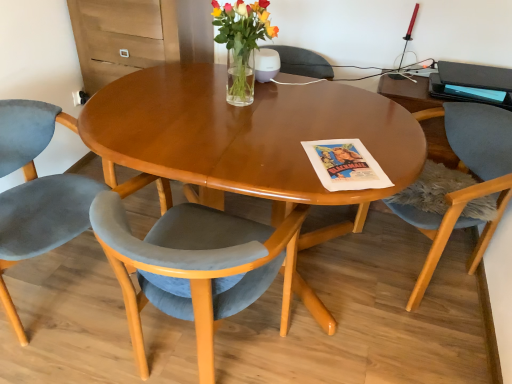
Find the location of a particular element. The height and width of the screenshot is (384, 512). velvet blue chair at lower right, which is the first chair in right-to-left order is located at coordinates (468, 187).

This screenshot has width=512, height=384. Describe the element at coordinates (468, 92) in the screenshot. I see `matte black magazine at upper right` at that location.

Describe the element at coordinates (36, 192) in the screenshot. Image resolution: width=512 pixels, height=384 pixels. I see `velvet grey chair at lower left, the third chair viewed from the right` at that location.

You are a GUI agent. You are given a task and a screenshot of the screen. Output one action in this format:
    pyautogui.click(x=<x>, y=<y>)
    Task: Click on the velvet blue chair at lower right, which is the first chair in right-to-left order
    Image resolution: width=512 pixels, height=384 pixels.
    Given the screenshot: What is the action you would take?
    pyautogui.click(x=468, y=187)

Is matte black magazine at upper right wider or thinner than velvet grey chair at lower left, placed as the second chair when sorted from right to left?

In the image, matte black magazine at upper right appears to be more narrow than velvet grey chair at lower left, placed as the second chair when sorted from right to left.

Can you confirm if matte black magazine at upper right is shorter than velvet grey chair at lower left, acting as the 2th chair starting from the left?

Yes.

Considering the sizes of objects matte black magazine at upper right and velvet grey chair at lower left, placed as the second chair when sorted from right to left, in the image provided, who is smaller, matte black magazine at upper right or velvet grey chair at lower left, placed as the second chair when sorted from right to left,?

matte black magazine at upper right.

Between point (480, 91) and point (197, 260), which one is positioned in front?

The point (197, 260) is closer to the camera.

Is velvet grey chair at lower left, placed as the second chair when sorted from right to left, to the left of velvet grey chair at lower left, which is the 1th chair in left-to-right order, from the viewer's perspective?

No.

Considering the positions of objects velvet grey chair at lower left, acting as the 2th chair starting from the left, and velvet grey chair at lower left, which is the 1th chair in left-to-right order, in the image provided, who is in front, velvet grey chair at lower left, acting as the 2th chair starting from the left, or velvet grey chair at lower left, which is the 1th chair in left-to-right order,?

velvet grey chair at lower left, acting as the 2th chair starting from the left, is more forward.

Consider the image. What's the angular difference between velvet grey chair at lower left, acting as the 2th chair starting from the left, and velvet grey chair at lower left, the third chair viewed from the right,'s facing directions?

99 degrees separate the facing orientations of velvet grey chair at lower left, acting as the 2th chair starting from the left, and velvet grey chair at lower left, the third chair viewed from the right.

Consider the image. Does velvet grey chair at lower left, placed as the second chair when sorted from right to left, have a lesser width compared to velvet grey chair at lower left, the third chair viewed from the right?

Indeed, velvet grey chair at lower left, placed as the second chair when sorted from right to left, has a lesser width compared to velvet grey chair at lower left, the third chair viewed from the right.

In the scene shown: Is velvet grey chair at lower left, which is the 1th chair in left-to-right order, further to the viewer compared to translucent glass vase at center?

No, velvet grey chair at lower left, which is the 1th chair in left-to-right order, is closer to the camera.

Is velvet grey chair at lower left, which is the 1th chair in left-to-right order, oriented towards translucent glass vase at center?

No, velvet grey chair at lower left, which is the 1th chair in left-to-right order, is not oriented towards translucent glass vase at center.

Considering the positions of objects velvet grey chair at lower left, which is the 1th chair in left-to-right order, and translucent glass vase at center in the image provided, who is more to the left, velvet grey chair at lower left, which is the 1th chair in left-to-right order, or translucent glass vase at center?

velvet grey chair at lower left, which is the 1th chair in left-to-right order.

Based on the photo, is velvet grey chair at lower left, which is the 1th chair in left-to-right order, not inside translucent glass vase at center?

Yes, velvet grey chair at lower left, which is the 1th chair in left-to-right order, is outside of translucent glass vase at center.

In the scene shown: From a real-world perspective, is translucent glass vase at center under velvet grey chair at lower left, acting as the 2th chair starting from the left?

No, from a real-world perspective, translucent glass vase at center is not beneath velvet grey chair at lower left, acting as the 2th chair starting from the left.

From the image's perspective, who appears lower, translucent glass vase at center or velvet grey chair at lower left, placed as the second chair when sorted from right to left?

velvet grey chair at lower left, placed as the second chair when sorted from right to left, appears lower in the image.

Between translucent glass vase at center and velvet grey chair at lower left, acting as the 2th chair starting from the left, which one appears on the right side from the viewer's perspective?

translucent glass vase at center is more to the right.

Would you say translucent glass vase at center is inside or outside velvet grey chair at lower left, acting as the 2th chair starting from the left?

translucent glass vase at center exists outside the volume of velvet grey chair at lower left, acting as the 2th chair starting from the left.

From a real-world perspective, between matte black magazine at upper right and translucent glass vase at center, who is vertically higher?

In real-world perspective, translucent glass vase at center is above.

Is there a large distance between matte black magazine at upper right and translucent glass vase at center?

That's not correct — matte black magazine at upper right is a little close to translucent glass vase at center.

Considering the points (455, 88) and (237, 34), which point is behind, point (455, 88) or point (237, 34)?

Point (455, 88)

Looking at this image, is matte black magazine at upper right wider than translucent glass vase at center?

Indeed, matte black magazine at upper right has a greater width compared to translucent glass vase at center.

From a real-world perspective, is matte black magazine at upper right above or below velvet grey chair at lower left, which is the 1th chair in left-to-right order?

In terms of real-world spatial position, matte black magazine at upper right is above velvet grey chair at lower left, which is the 1th chair in left-to-right order.

Where is `the 2nd chair in front of the matte black magazine at upper right`? The image size is (512, 384). the 2nd chair in front of the matte black magazine at upper right is located at coordinates (36, 192).

Would you consider matte black magazine at upper right to be distant from velvet grey chair at lower left, the third chair viewed from the right?

Yes, matte black magazine at upper right and velvet grey chair at lower left, the third chair viewed from the right, are located far from each other.

In the scene shown: From a real-world perspective, is translucent glass vase at center below velvet grey chair at lower left, which is the 1th chair in left-to-right order?

Actually, translucent glass vase at center is physically above velvet grey chair at lower left, which is the 1th chair in left-to-right order, in the real world.

Considering the sizes of translucent glass vase at center and velvet grey chair at lower left, the third chair viewed from the right, in the image, is translucent glass vase at center wider or thinner than velvet grey chair at lower left, the third chair viewed from the right,?

Considering their sizes, translucent glass vase at center looks slimmer than velvet grey chair at lower left, the third chair viewed from the right.

Considering the positions of objects translucent glass vase at center and velvet grey chair at lower left, which is the 1th chair in left-to-right order, in the image provided, who is more to the left, translucent glass vase at center or velvet grey chair at lower left, which is the 1th chair in left-to-right order,?

From the viewer's perspective, velvet grey chair at lower left, which is the 1th chair in left-to-right order, appears more on the left side.

Identify the location of magazine above the velvet grey chair at lower left, acting as the 2th chair starting from the left (from a real-world perspective). (468, 92).

Find the location of a particular element. This screenshot has height=384, width=512. the 1st chair above when counting from the velvet grey chair at lower left, acting as the 2th chair starting from the left (from the image's perspective) is located at coordinates (36, 192).

Looking at the image, which one is located further to matte black magazine at upper right, velvet grey chair at lower left, which is the 1th chair in left-to-right order, or velvet grey chair at lower left, acting as the 2th chair starting from the left?

velvet grey chair at lower left, which is the 1th chair in left-to-right order, lies further to matte black magazine at upper right than the other object.

Which object lies nearer to the anchor point velvet grey chair at lower left, which is the 1th chair in left-to-right order, matte black magazine at upper right or velvet blue chair at lower right, marked as the third chair in a left-to-right arrangement?

velvet blue chair at lower right, marked as the third chair in a left-to-right arrangement.

Which object lies further to the anchor point velvet blue chair at lower right, marked as the third chair in a left-to-right arrangement, velvet grey chair at lower left, the third chair viewed from the right, or translucent glass vase at center?

Based on the image, velvet grey chair at lower left, the third chair viewed from the right, appears to be further to velvet blue chair at lower right, marked as the third chair in a left-to-right arrangement.

Looking at the image, which one is located closer to velvet grey chair at lower left, which is the 1th chair in left-to-right order, velvet grey chair at lower left, placed as the second chair when sorted from right to left, or translucent glass vase at center?

velvet grey chair at lower left, placed as the second chair when sorted from right to left, is closer to velvet grey chair at lower left, which is the 1th chair in left-to-right order.

Which object lies nearer to the anchor point velvet grey chair at lower left, placed as the second chair when sorted from right to left, matte black magazine at upper right or translucent glass vase at center?

translucent glass vase at center lies closer to velvet grey chair at lower left, placed as the second chair when sorted from right to left, than the other object.

When comparing their distances from matte black magazine at upper right, does translucent glass vase at center or velvet blue chair at lower right, marked as the third chair in a left-to-right arrangement, seem closer?

velvet blue chair at lower right, marked as the third chair in a left-to-right arrangement, is positioned closer to the anchor matte black magazine at upper right.

Based on the photo, when comparing their distances from matte black magazine at upper right, does translucent glass vase at center or velvet grey chair at lower left, placed as the second chair when sorted from right to left, seem closer?

translucent glass vase at center is positioned closer to the anchor matte black magazine at upper right.

When comparing their distances from velvet blue chair at lower right, which is the first chair in right-to-left order, does matte black magazine at upper right or translucent glass vase at center seem further?

The object further to velvet blue chair at lower right, which is the first chair in right-to-left order, is translucent glass vase at center.

Image resolution: width=512 pixels, height=384 pixels. In order to click on floral arrangement between velvet grey chair at lower left, which is the 1th chair in left-to-right order, and matte black magazine at upper right in this screenshot , I will do `click(241, 43)`.

This screenshot has width=512, height=384. I want to click on chair between translucent glass vase at center and matte black magazine at upper right, so click(468, 187).

The width and height of the screenshot is (512, 384). In order to click on floral arrangement situated between velvet grey chair at lower left, which is the 1th chair in left-to-right order, and velvet blue chair at lower right, which is the first chair in right-to-left order, from left to right in this screenshot , I will do `click(241, 43)`.

You are a GUI agent. You are given a task and a screenshot of the screen. Output one action in this format:
    pyautogui.click(x=<x>, y=<y>)
    Task: Click on the chair between velvet grey chair at lower left, the third chair viewed from the right, and velvet blue chair at lower right, marked as the third chair in a left-to-right arrangement
    This screenshot has width=512, height=384.
    Given the screenshot: What is the action you would take?
    pyautogui.click(x=191, y=265)